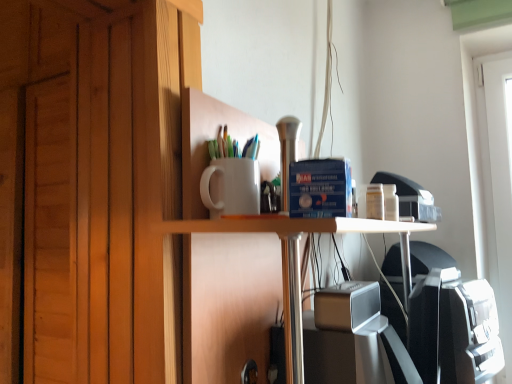
Find the location of a particular element. white matte cup at upper center is located at coordinates (90, 184).

Locate an element on the screen. Image resolution: width=512 pixels, height=384 pixels. white glossy table at center is located at coordinates (296, 259).

Identify the location of satin silver speaker at center. pos(346,305).

From the image's perspective, which is above, satin silver speaker at center or white matte cup at upper center?

white matte cup at upper center, from the image's perspective.

Is satin silver speaker at center outside of white matte cup at upper center?

satin silver speaker at center is positioned outside white matte cup at upper center.

From a real-world perspective, who is located lower, satin silver speaker at center or white matte cup at upper center?

In real-world perspective, satin silver speaker at center is lower.

In the scene shown: Is satin silver speaker at center not near white matte cup at upper center?

Actually, satin silver speaker at center and white matte cup at upper center are a little close together.

Is white glossy table at center positioned with its back to white matte cup at upper center?

That's right, white glossy table at center is facing away from white matte cup at upper center.

At what (x,y) coordinates should I click in order to perform the action: click on table in front of the white matte cup at upper center. Please return your answer as a coordinate pair (x, y). The width and height of the screenshot is (512, 384). Looking at the image, I should click on (296, 259).

Does white glossy table at center appear on the right side of white matte cup at upper center?

Correct, you'll find white glossy table at center to the right of white matte cup at upper center.

From a real-world perspective, does white glossy table at center stand above satin silver speaker at center?

No, from a real-world perspective, white glossy table at center is not on top of satin silver speaker at center.

Does white glossy table at center have a smaller size compared to satin silver speaker at center?

Incorrect, white glossy table at center is not smaller in size than satin silver speaker at center.

Is white glossy table at center not near satin silver speaker at center?

white glossy table at center is actually quite close to satin silver speaker at center.

Does point (109, 267) appear closer or farther from the camera than point (355, 328)?

Point (109, 267).

From the image's perspective, is white matte cup at upper center on satin silver speaker at center?

Yes.

Would you say satin silver speaker at center is part of white matte cup at upper center's contents?

No, satin silver speaker at center is not inside white matte cup at upper center.

From the image's perspective, between white matte cup at upper center and white glossy table at center, which one is located above?

white matte cup at upper center appears higher in the image.

In the image, is white matte cup at upper center on the left side or the right side of white glossy table at center?

In the image, white matte cup at upper center appears on the left side of white glossy table at center.

How different are the orientations of white matte cup at upper center and white glossy table at center in degrees?

The angular difference between white matte cup at upper center and white glossy table at center is 91 degrees.

Is point (148, 290) closer or farther from the camera than point (264, 228)?

Clearly, point (148, 290) is more distant from the camera than point (264, 228).

Identify the location of appliance that appears on the left of white glossy table at center. This screenshot has height=384, width=512. (346, 305).

Can we say satin silver speaker at center lies outside white glossy table at center?

No, satin silver speaker at center is inside white glossy table at center's boundary.

From the image's perspective, between satin silver speaker at center and white glossy table at center, which one is located above?

From the image's view, satin silver speaker at center is above.

In order to click on appliance to the right of white matte cup at upper center in this screenshot , I will do `click(346, 305)`.

Identify the location of table directly beneath the white matte cup at upper center (from a real-world perspective). This screenshot has height=384, width=512. (296, 259).

Looking at the image, which one is located further to white matte cup at upper center, satin silver speaker at center or white glossy table at center?

satin silver speaker at center.

Based on the photo, considering their positions, is white glossy table at center positioned closer to white matte cup at upper center than satin silver speaker at center?

white glossy table at center.

When comparing their distances from white glossy table at center, does white matte cup at upper center or satin silver speaker at center seem closer?

satin silver speaker at center lies closer to white glossy table at center than the other object.

When comparing their distances from satin silver speaker at center, does white glossy table at center or white matte cup at upper center seem further?

The object further to satin silver speaker at center is white matte cup at upper center.

Looking at the image, which one is located closer to satin silver speaker at center, white matte cup at upper center or white glossy table at center?

white glossy table at center is positioned closer to the anchor satin silver speaker at center.

Estimate the real-world distances between objects in this image. Which object is further from white glossy table at center, satin silver speaker at center or white matte cup at upper center?

The object further to white glossy table at center is white matte cup at upper center.

Where is `appliance located between white matte cup at upper center and white glossy table at center in the left-right direction`? This screenshot has width=512, height=384. appliance located between white matte cup at upper center and white glossy table at center in the left-right direction is located at coordinates (346, 305).